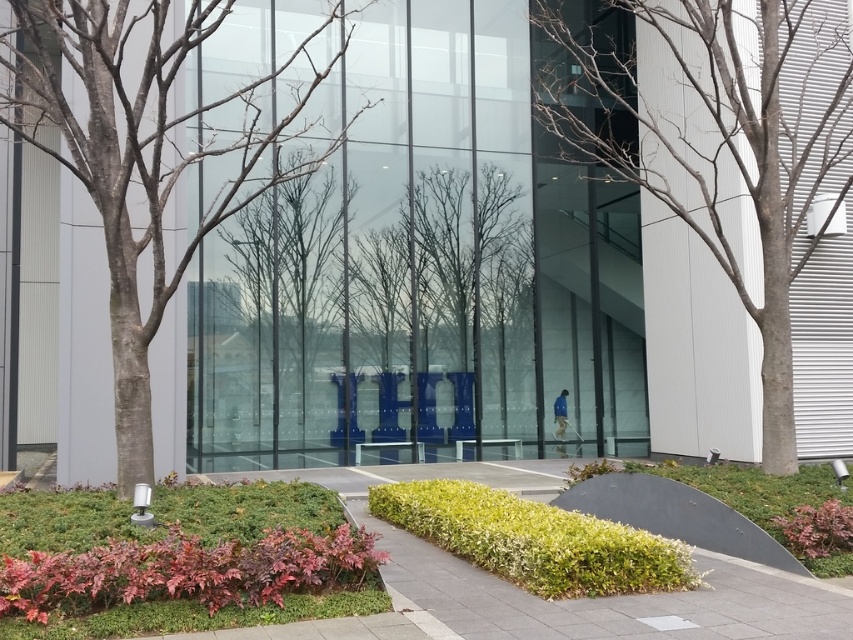
Measure the distance from green grass at lower center to green leafy hedge at lower center.

green grass at lower center is 15.82 inches away from green leafy hedge at lower center.

Does green grass at lower center have a lesser width compared to green leafy hedge at lower center?

No, green grass at lower center is not thinner than green leafy hedge at lower center.

Does point (514, 627) come in front of point (607, 524)?

That is True.

This screenshot has width=853, height=640. What are the coordinates of `green grass at lower center` in the screenshot? It's located at (608, 598).

Between bare branches at center and purple-leaved hedge at lower left, which one has more height?

bare branches at center

Who is positioned more to the left, bare branches at center or purple-leaved hedge at lower left?

From the viewer's perspective, bare branches at center appears more on the left side.

Which is behind, point (315, 268) or point (135, 576)?

The point (315, 268) is more distant.

You are a GUI agent. You are given a task and a screenshot of the screen. Output one action in this format:
    pyautogui.click(x=<x>, y=<y>)
    Task: Click on the bare branches at center
    The image size is (853, 640).
    Given the screenshot: What is the action you would take?
    pyautogui.click(x=294, y=304)

The image size is (853, 640). Describe the element at coordinates (187, 572) in the screenshot. I see `purple-leaved hedge at lower left` at that location.

Which is above, purple-leaved hedge at lower left or green leafy hedge at lower center?

purple-leaved hedge at lower left is higher up.

Who is more distant from viewer, (257, 554) or (421, 490)?

The point (421, 490) is more distant.

In order to click on purple-leaved hedge at lower left in this screenshot , I will do `click(187, 572)`.